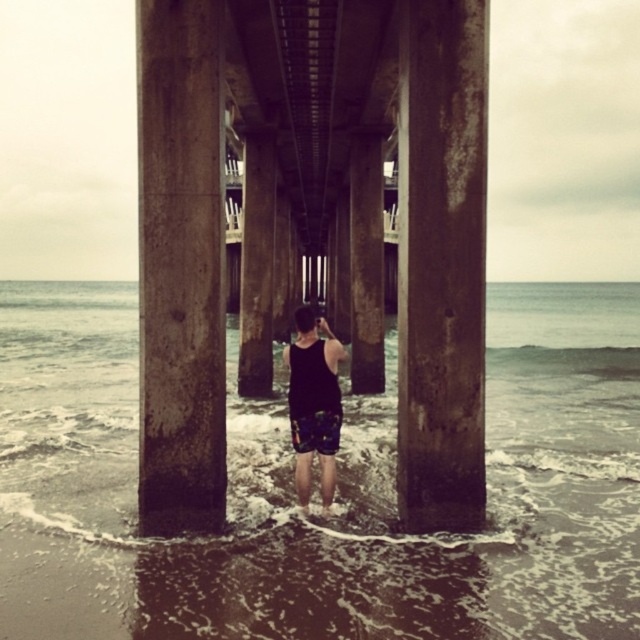
Question: Considering the real-world distances, which object is farthest from the rusty concrete pillar at center?

Choices:
 (A) rusty metal pillar at center
 (B) sandy water at lower center
 (C) black matte tank top at center
 (D) dark gray concrete pillar at center

Answer: (B)

Question: Which object is farther from the camera taking this photo?

Choices:
 (A) dark gray concrete pillar at center
 (B) concrete textured pillar at center

Answer: (A)

Question: Among these points, which one is nearest to the camera?

Choices:
 (A) (160, 72)
 (B) (128, 385)

Answer: (A)

Question: Is rusty concrete pillar at center above black matte tank top at center?

Choices:
 (A) yes
 (B) no

Answer: (B)

Question: Can you confirm if dark gray concrete pillar at center is positioned below rusty concrete pillar at center?

Choices:
 (A) no
 (B) yes

Answer: (A)

Question: Can you confirm if dark gray concrete pillar at center is positioned above black matte tank top at center?

Choices:
 (A) no
 (B) yes

Answer: (B)